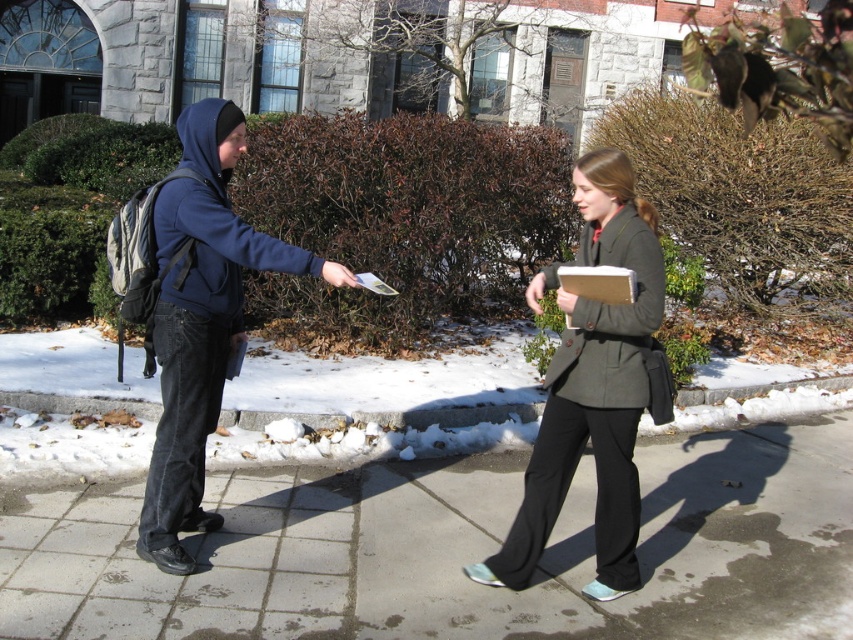
Which of these two, concrete sidewalk at center or matte blue hoodie at left, stands shorter?

concrete sidewalk at center

Can you confirm if concrete sidewalk at center is taller than matte blue hoodie at left?

No.

What are the coordinates of `concrete sidewalk at center` in the screenshot? It's located at (454, 550).

What are the coordinates of `concrete sidewalk at center` in the screenshot? It's located at (454, 550).

Between point (190, 634) and point (587, 388), which one is positioned in front?

Point (190, 634) is in front.

Can you confirm if concrete sidewalk at center is shorter than dark gray wool coat at center?

Yes, concrete sidewalk at center is shorter than dark gray wool coat at center.

Is point (579, 582) positioned behind point (602, 576)?

Yes, point (579, 582) is behind point (602, 576).

Find the location of a particular element. The height and width of the screenshot is (640, 853). concrete sidewalk at center is located at coordinates (454, 550).

Does dark gray wool coat at center have a larger size compared to matte gray blazer at center?

Actually, dark gray wool coat at center might be smaller than matte gray blazer at center.

What do you see at coordinates (592, 387) in the screenshot? I see `dark gray wool coat at center` at bounding box center [592, 387].

Locate an element on the screen. dark gray wool coat at center is located at coordinates (592, 387).

I want to click on dark gray wool coat at center, so click(x=592, y=387).